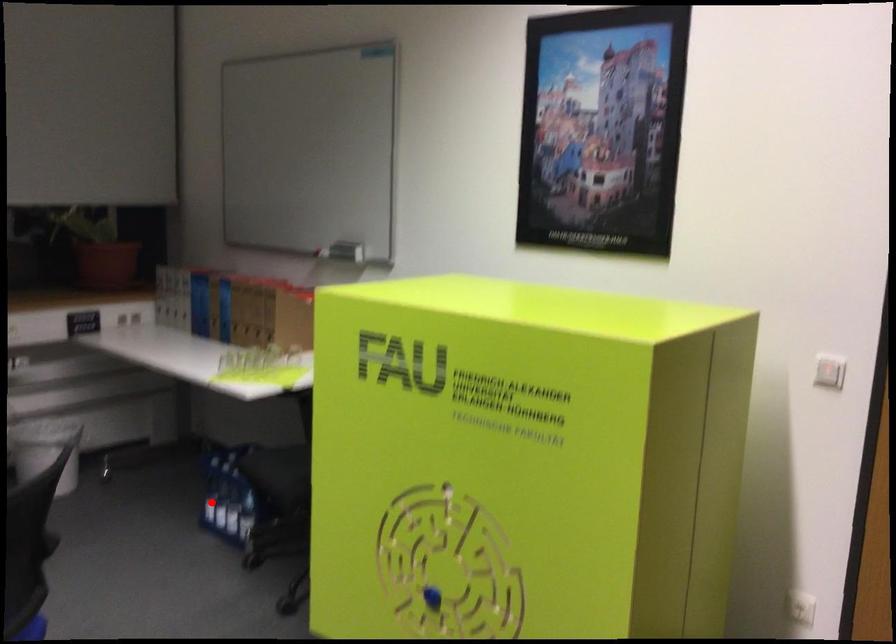
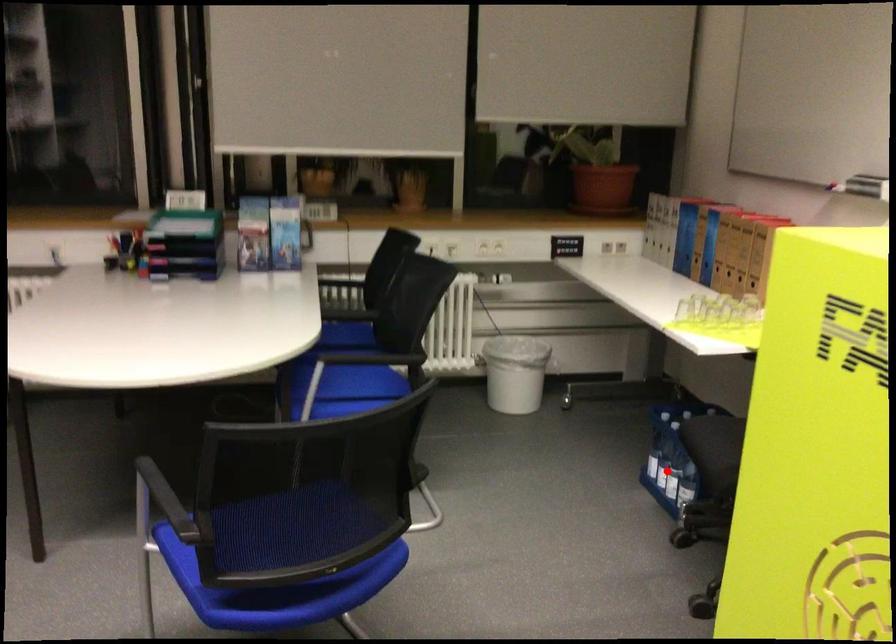
I am providing you with two images of the same scene from different viewpoints. A red point is marked on the first image and another point is marked on the second image. Does the point marked in image1 correspond to the same location as the one in image2?

No